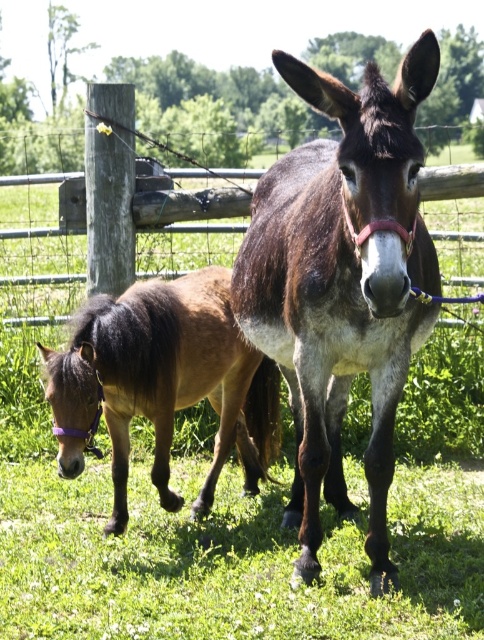
Looking at this image, can you confirm if brown fuzzy mule at center is positioned above brown fuzzy pony at lower left?

Yes, brown fuzzy mule at center is above brown fuzzy pony at lower left.

The image size is (484, 640). I want to click on brown fuzzy mule at center, so click(x=342, y=282).

The width and height of the screenshot is (484, 640). In order to click on brown fuzzy mule at center in this screenshot , I will do `click(342, 282)`.